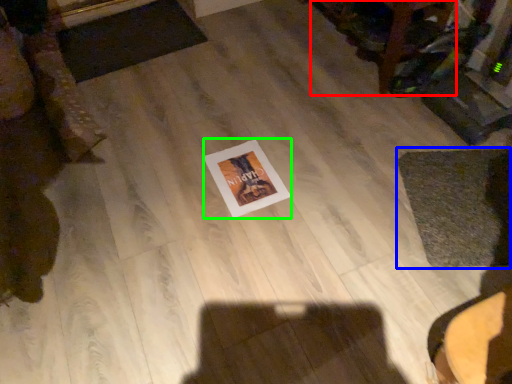
Question: Based on their relative distances, which object is nearer to furniture (highlighted by a red box)? Choose from mat (highlighted by a blue box) and postcard (highlighted by a green box).

Choices:
 (A) mat
 (B) postcard

Answer: (A)